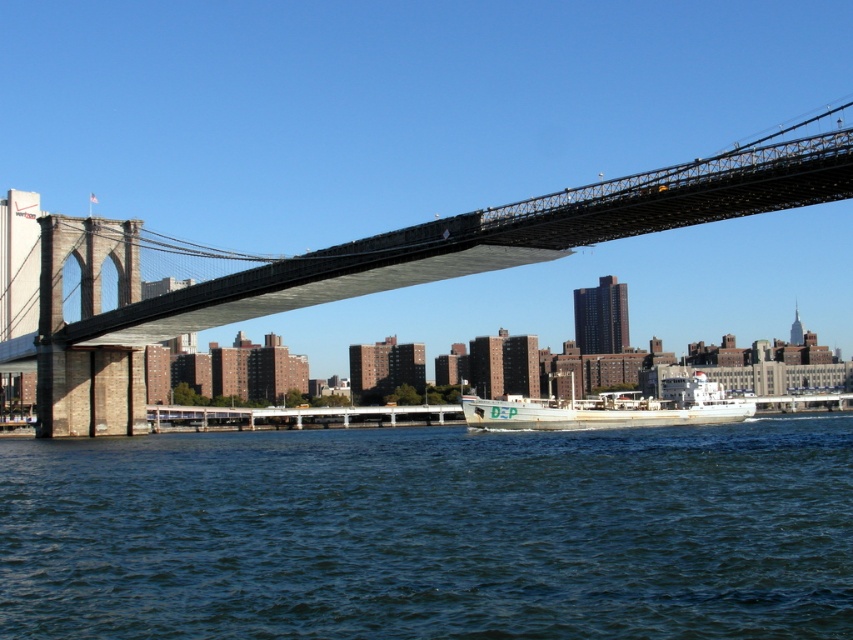
You are a photographer planning to take a photo of the Brooklyn Bridge. You notice the dark blue water at center and the white matte boat at center in your frame. Which object should you adjust your focus to capture the reflection of the bridge in the water?

The dark blue water at center is positioned under the white matte boat at center. To capture the reflection of the bridge in the water, you should focus on the dark blue water at center since reflections appear on the water surface below objects like the boat.